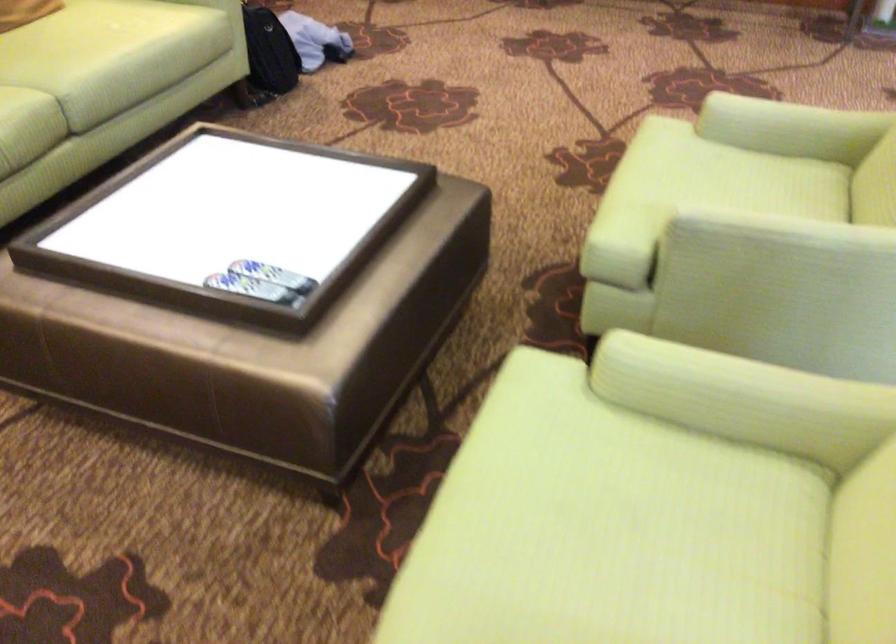
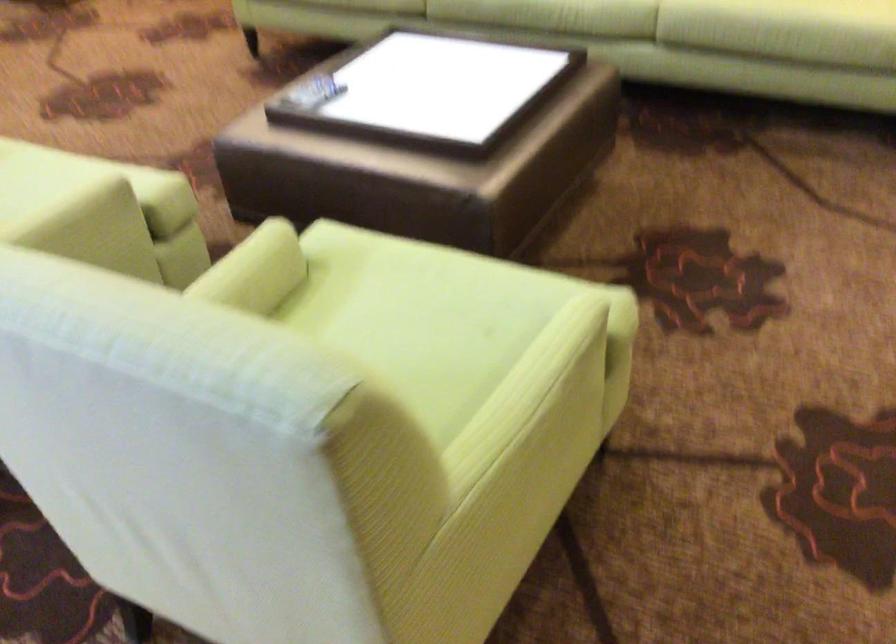
Where in the second image is the point corresponding to (717,184) from the first image?

(410, 328)